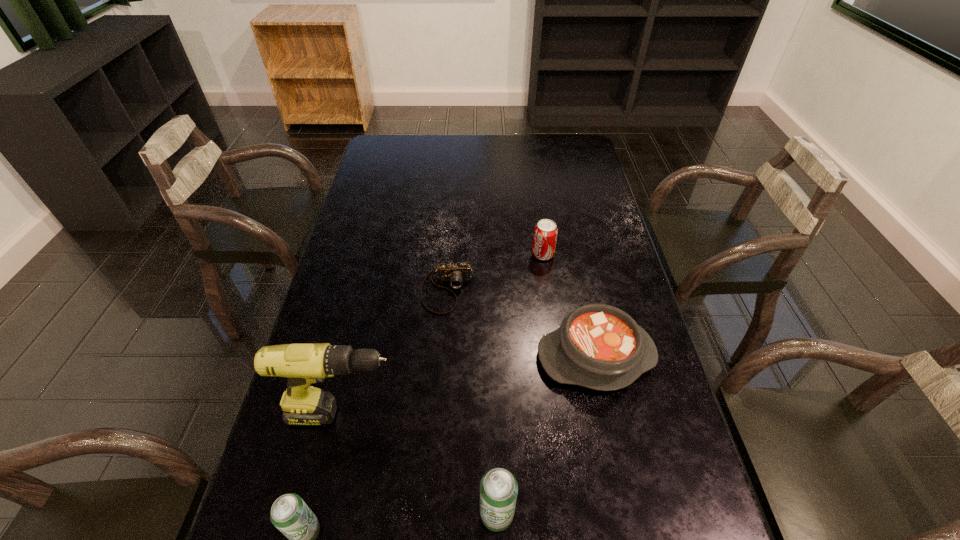
Find the location of a particular element. The image size is (960, 540). free space at the right edge of the desktop is located at coordinates (590, 210).

You are a GUI agent. You are given a task and a screenshot of the screen. Output one action in this format:
    pyautogui.click(x=<x>, y=<y>)
    Task: Click on the free space at the far left corner of the desktop
    This screenshot has width=960, height=540.
    Given the screenshot: What is the action you would take?
    pyautogui.click(x=409, y=142)

Find the location of `vacant space that is in between the tallest object and the fourth nearest object`. vacant space that is in between the tallest object and the fourth nearest object is located at coordinates (470, 385).

Image resolution: width=960 pixels, height=540 pixels. I want to click on vacant area that lies between the fifth nearest object and the third object from right to left, so click(472, 403).

Where is `free space that is in between the soda and the taller beer can`? The height and width of the screenshot is (540, 960). free space that is in between the soda and the taller beer can is located at coordinates (519, 384).

You are a GUI agent. You are given a task and a screenshot of the screen. Output one action in this format:
    pyautogui.click(x=<x>, y=<y>)
    Task: Click on the vacant area that lies between the camera and the second shortest object
    This screenshot has width=960, height=540.
    Given the screenshot: What is the action you would take?
    pyautogui.click(x=521, y=323)

The height and width of the screenshot is (540, 960). Find the location of `empty space that is in between the taller beer can and the soda`. empty space that is in between the taller beer can and the soda is located at coordinates (519, 384).

What are the coordinates of `blank region between the farthest object and the second farthest object` in the screenshot? It's located at (495, 273).

Locate an element on the screen. The image size is (960, 540). blank region between the fourth nearest object and the right beer can is located at coordinates (546, 435).

The image size is (960, 540). I want to click on vacant space that is in between the soda and the tallest object, so click(444, 334).